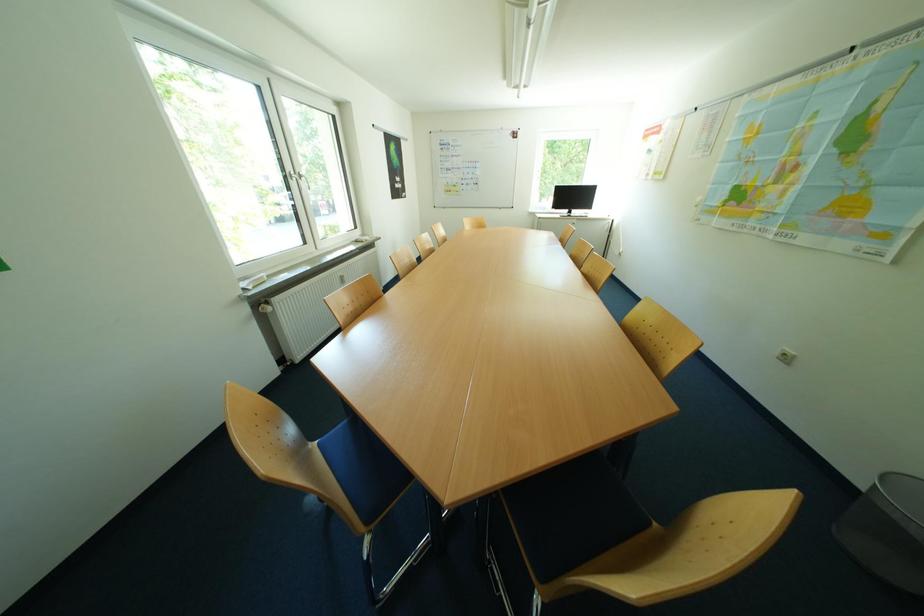
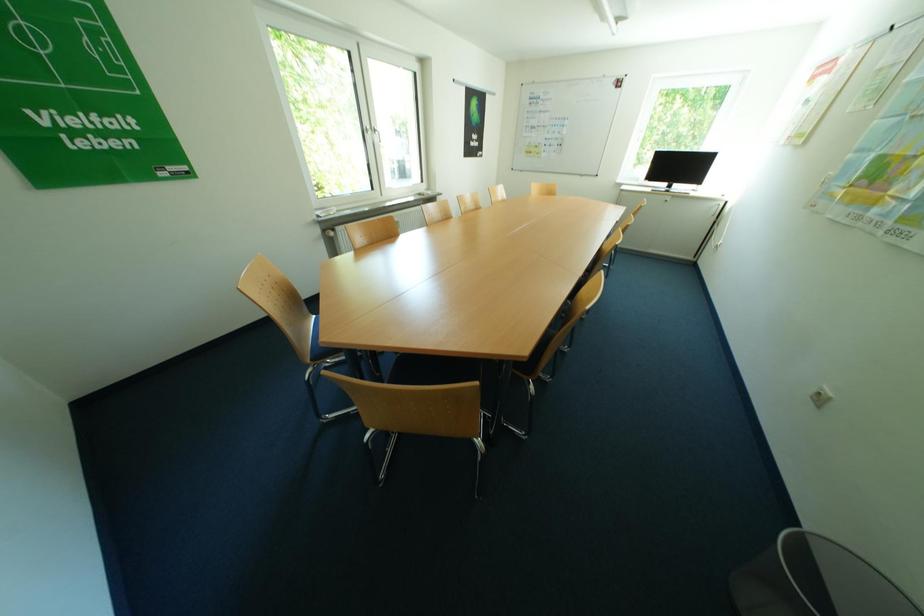
Question: The images are taken continuously from a first-person perspective. In which direction is your viewpoint rotating?

Choices:
 (A) Left
 (B) Right
 (C) Up
 (D) Down

Answer: (A)